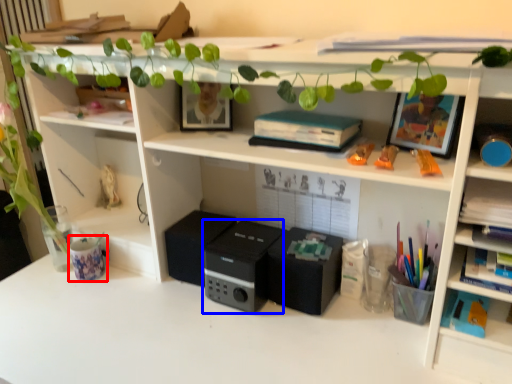
Question: Which point is further to the camera, stationery (highlighted by a red box) or speaker (highlighted by a blue box)?

Choices:
 (A) stationery
 (B) speaker

Answer: (A)